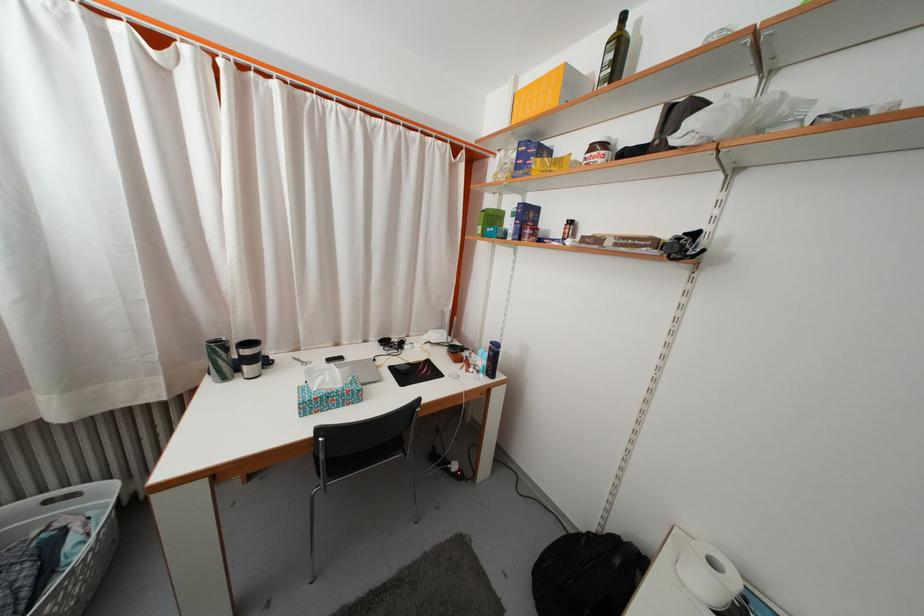
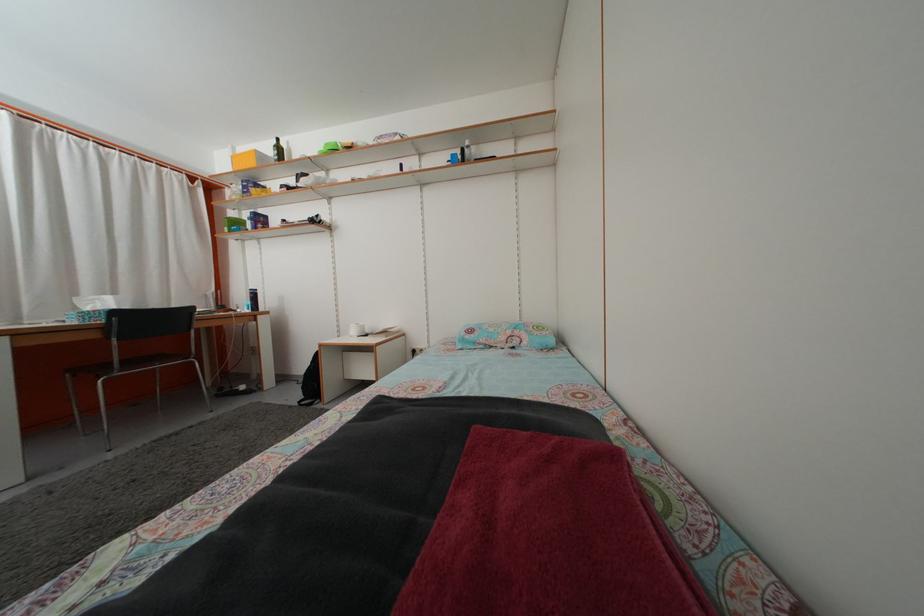
In the second image, find the point that corresponds to the point at 494,209 in the first image.

(237, 223)